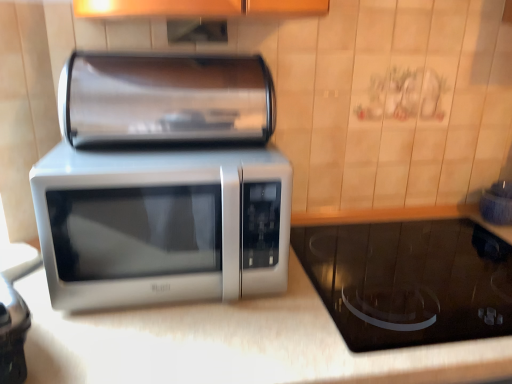
Question: Considering the relative positions of white glossy countertop at center and black glass cooktop at lower right, which is counted as the second appliance, starting from the left, in the image provided, is white glossy countertop at center behind black glass cooktop at lower right, which is counted as the second appliance, starting from the left,?

Choices:
 (A) no
 (B) yes

Answer: (A)

Question: Is white glossy countertop at center at the right side of black glass cooktop at lower right, placed as the second appliance when sorted from top to bottom?

Choices:
 (A) yes
 (B) no

Answer: (B)

Question: Can you confirm if white glossy countertop at center is taller than black glass cooktop at lower right, the first appliance from the bottom?

Choices:
 (A) yes
 (B) no

Answer: (A)

Question: Is white glossy countertop at center positioned before black glass cooktop at lower right, placed as the second appliance when sorted from top to bottom?

Choices:
 (A) no
 (B) yes

Answer: (B)

Question: From the image's perspective, is white glossy countertop at center beneath black glass cooktop at lower right, which is the 1th appliance in right-to-left order?

Choices:
 (A) no
 (B) yes

Answer: (B)

Question: Is white glossy countertop at center positioned with its back to black glass cooktop at lower right, the first appliance from the bottom?

Choices:
 (A) yes
 (B) no

Answer: (B)

Question: Is satin silver paper towel holder at upper center, the 2th appliance when ordered from bottom to top, at the left side of black glass cooktop at lower right, the first appliance from the bottom?

Choices:
 (A) no
 (B) yes

Answer: (B)

Question: Is satin silver paper towel holder at upper center, the 2th appliance when ordered from bottom to top, shorter than black glass cooktop at lower right, the first appliance from the bottom?

Choices:
 (A) yes
 (B) no

Answer: (B)

Question: Is satin silver paper towel holder at upper center, positioned as the first appliance in left-to-right order, located outside black glass cooktop at lower right, which is the 1th appliance in right-to-left order?

Choices:
 (A) yes
 (B) no

Answer: (A)

Question: From a real-world perspective, does satin silver paper towel holder at upper center, placed as the second appliance when sorted from right to left, sit lower than black glass cooktop at lower right, the first appliance from the bottom?

Choices:
 (A) yes
 (B) no

Answer: (B)

Question: Can you confirm if satin silver paper towel holder at upper center, the 2th appliance when ordered from bottom to top, is positioned to the right of black glass cooktop at lower right, placed as the second appliance when sorted from top to bottom?

Choices:
 (A) yes
 (B) no

Answer: (B)

Question: Does satin silver paper towel holder at upper center, which is the first appliance from top to bottom, have a greater width compared to black glass cooktop at lower right, placed as the second appliance when sorted from top to bottom?

Choices:
 (A) yes
 (B) no

Answer: (B)

Question: From a real-world perspective, is black glass cooktop at lower right, placed as the second appliance when sorted from top to bottom, under satin silver microwave at center?

Choices:
 (A) yes
 (B) no

Answer: (A)